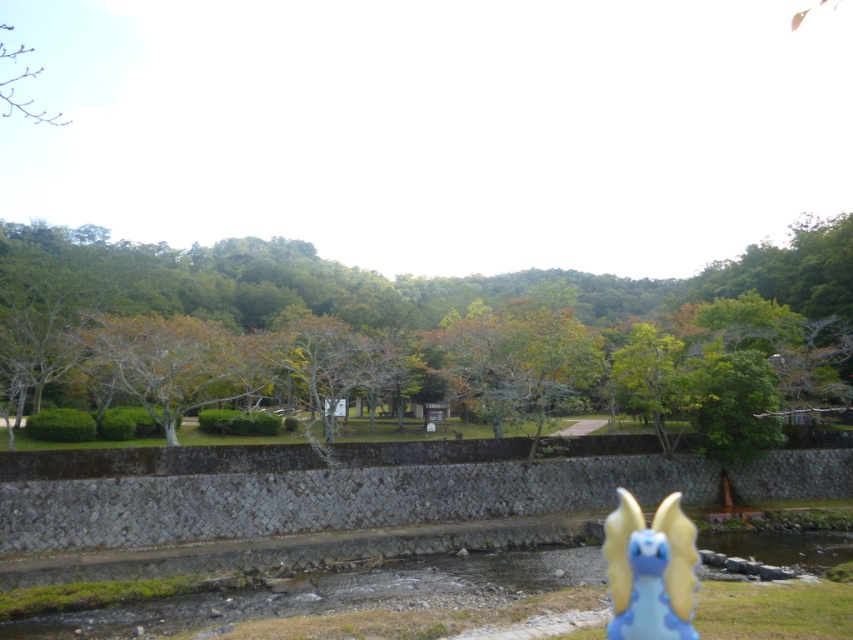
Question: Where is green leafy tree at center located in relation to bare branches at upper left in the image?

Choices:
 (A) left
 (B) right

Answer: (B)

Question: Which point is closer to the camera?

Choices:
 (A) (619, 632)
 (B) (12, 92)

Answer: (A)

Question: Among these objects, which one is nearest to the camera?

Choices:
 (A) green leafy tree at center
 (B) bare branches at upper left

Answer: (A)

Question: Can you confirm if blue rubber dragon at lower right is smaller than bare branches at upper left?

Choices:
 (A) no
 (B) yes

Answer: (B)

Question: Which point is closer to the camera taking this photo?

Choices:
 (A) (36, 74)
 (B) (694, 582)

Answer: (B)

Question: Considering the relative positions of green leafy tree at center and bare branches at upper left in the image provided, where is green leafy tree at center located with respect to bare branches at upper left?

Choices:
 (A) above
 (B) below

Answer: (B)